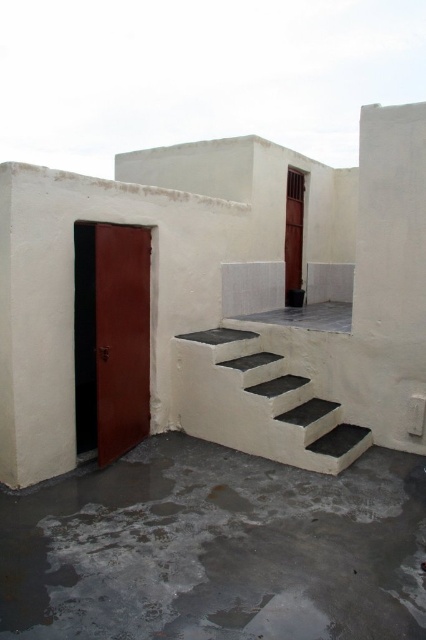
You are standing in front of the outdoor structure and notice two points marked in the scene. The first point is at coordinate point (224, 481) and the second is at point (146, 422). Which point is nearer to you?

Point (224, 481) is closer to the camera than point (146, 422), so the first point is nearer to you.

You are standing on the gray concrete at center and want to reach the satin wood door at center. Which direction should you move to get closer to the door?

The gray concrete at center is not as tall as the satin wood door at center, so you should move forward towards the satin wood door at center to get closer.

You are standing in front of the satin wood door at center and want to reach the white concrete stairs at center. In which direction should you move to get there?

The white concrete stairs at center is to the right of the satin wood door at center, so you should move to the right to reach them.